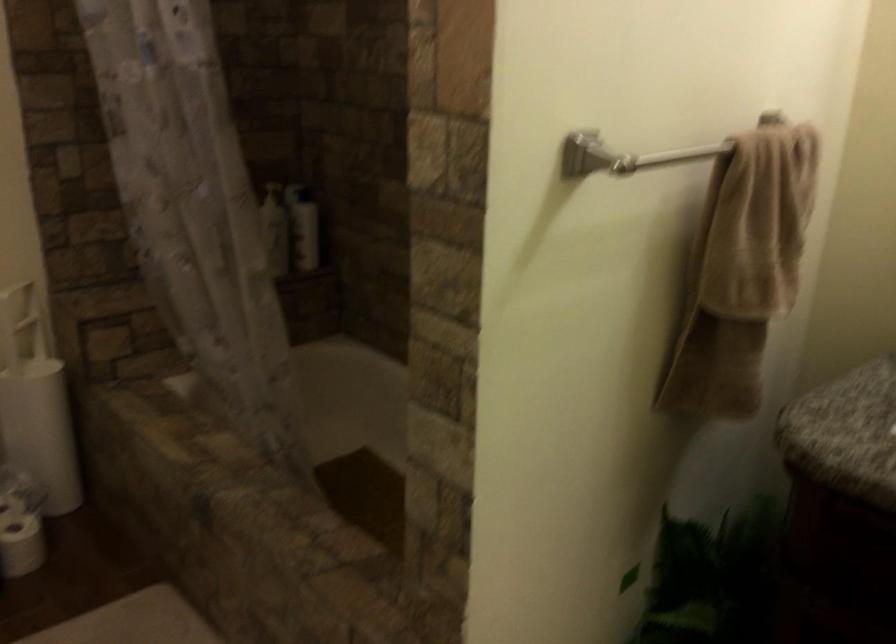
Find where to pull the toilet brush handle. Please return your answer as a coordinate pair (x, y).

(20, 323)